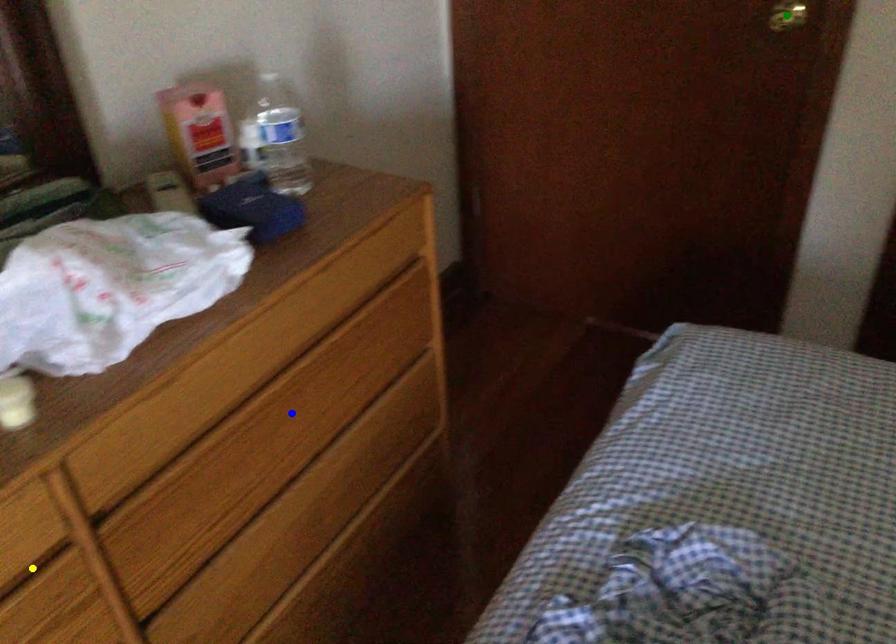
Order these from farthest to nearest:
green point, blue point, yellow point

green point, blue point, yellow point